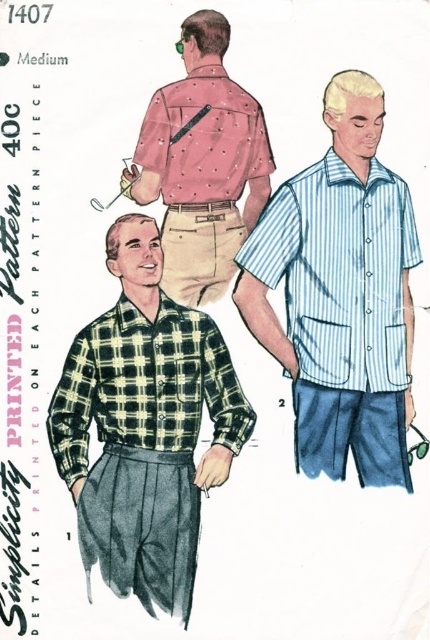
Question: Can you confirm if light blue striped shirt at right is smaller than pink dotted fabric shirt at back?

Choices:
 (A) no
 (B) yes

Answer: (A)

Question: Which object is positioned farthest from the green plaid shirt at center?

Choices:
 (A) pink dotted shirt at upper center
 (B) pink dotted fabric shirt at back
 (C) green checkered shirt at center
 (D) light blue striped shirt at right

Answer: (B)

Question: Based on their relative distances, which object is farther from the green checkered shirt at center?

Choices:
 (A) pink dotted fabric shirt at back
 (B) green plaid shirt at center

Answer: (A)

Question: Does pink dotted shirt at upper center have a lesser width compared to green checkered shirt at center?

Choices:
 (A) yes
 (B) no

Answer: (A)

Question: Observing the image, what is the correct spatial positioning of green plaid shirt at center in reference to pink dotted fabric shirt at back?

Choices:
 (A) left
 (B) right

Answer: (A)

Question: Which of these objects is positioned closest to the pink dotted fabric shirt at back?

Choices:
 (A) pink dotted shirt at upper center
 (B) light blue striped shirt at right

Answer: (A)